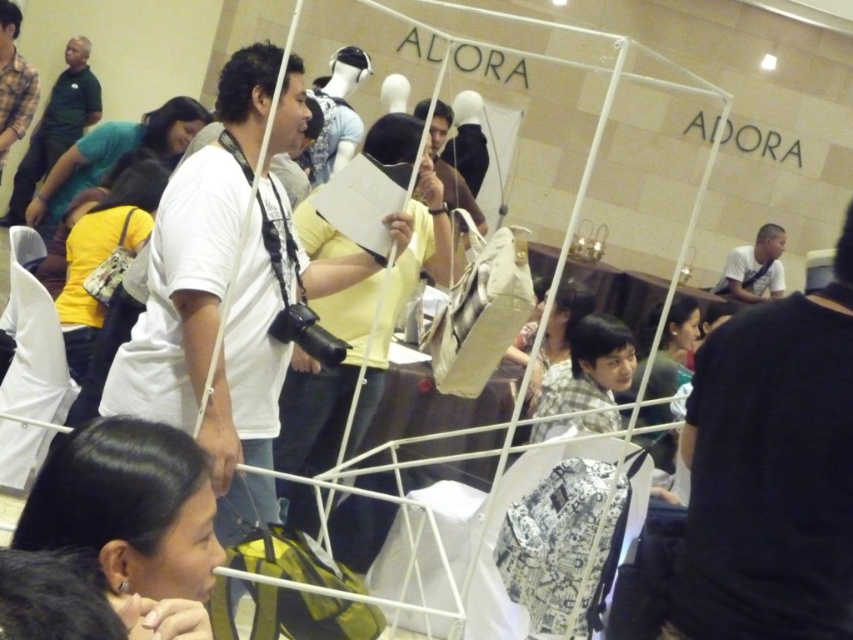
Question: Can you confirm if black hair at lower left is thinner than white shirt at center?

Choices:
 (A) no
 (B) yes

Answer: (B)

Question: Does black hair at lower left have a lesser width compared to white shirt at center?

Choices:
 (A) no
 (B) yes

Answer: (B)

Question: Which point appears farthest from the camera in this image?

Choices:
 (A) (775, 262)
 (B) (190, 504)

Answer: (A)

Question: Which object is farther from the camera taking this photo?

Choices:
 (A) black hair at lower left
 (B) white shirt at center

Answer: (B)

Question: Does black hair at lower left have a lesser width compared to white shirt at center?

Choices:
 (A) no
 (B) yes

Answer: (B)